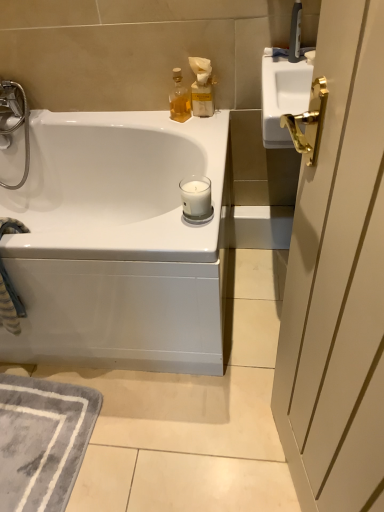
Question: Is white glossy bathtub at upper left to the right of white glass candle at center from the viewer's perspective?

Choices:
 (A) no
 (B) yes

Answer: (A)

Question: From the image's perspective, would you say white glossy bathtub at upper left is shown under white glass candle at center?

Choices:
 (A) no
 (B) yes

Answer: (B)

Question: Does white glossy bathtub at upper left have a smaller size compared to white glass candle at center?

Choices:
 (A) no
 (B) yes

Answer: (A)

Question: Can you confirm if white glossy bathtub at upper left is shorter than white glass candle at center?

Choices:
 (A) yes
 (B) no

Answer: (B)

Question: Does white glossy bathtub at upper left have a greater height compared to white glass candle at center?

Choices:
 (A) no
 (B) yes

Answer: (B)

Question: Is white glossy bathtub at upper left next to white glass candle at center?

Choices:
 (A) yes
 (B) no

Answer: (B)

Question: Is gray soft rug at lower left in front of matte beige bottle at upper right?

Choices:
 (A) yes
 (B) no

Answer: (A)

Question: From the image's perspective, is gray soft rug at lower left on matte beige bottle at upper right?

Choices:
 (A) yes
 (B) no

Answer: (B)

Question: From a real-world perspective, is gray soft rug at lower left on top of matte beige bottle at upper right?

Choices:
 (A) no
 (B) yes

Answer: (A)

Question: Considering the relative sizes of gray soft rug at lower left and matte beige bottle at upper right in the image provided, is gray soft rug at lower left wider than matte beige bottle at upper right?

Choices:
 (A) no
 (B) yes

Answer: (B)

Question: Does gray soft rug at lower left appear on the right side of matte beige bottle at upper right?

Choices:
 (A) yes
 (B) no

Answer: (B)

Question: From a real-world perspective, is gray soft rug at lower left located beneath matte beige bottle at upper right?

Choices:
 (A) no
 (B) yes

Answer: (B)

Question: Can you confirm if matte beige bottle at upper right is positioned to the left of white glossy bathtub at upper left?

Choices:
 (A) no
 (B) yes

Answer: (A)